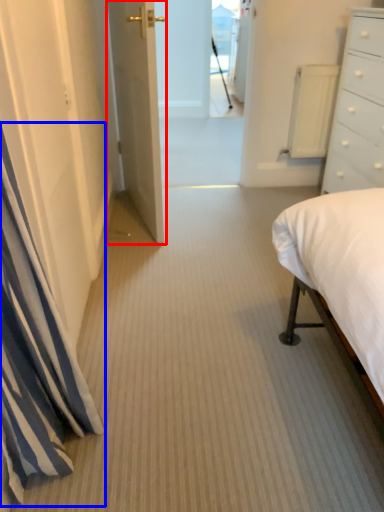
Question: Which of the following is the farthest to the observer, door (highlighted by a red box) or curtain (highlighted by a blue box)?

Choices:
 (A) door
 (B) curtain

Answer: (A)